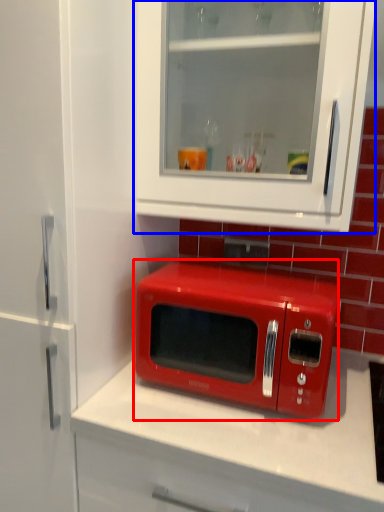
Question: Among these objects, which one is farthest to the camera, microwave oven (highlighted by a red box) or cabinetry (highlighted by a blue box)?

Choices:
 (A) microwave oven
 (B) cabinetry

Answer: (A)